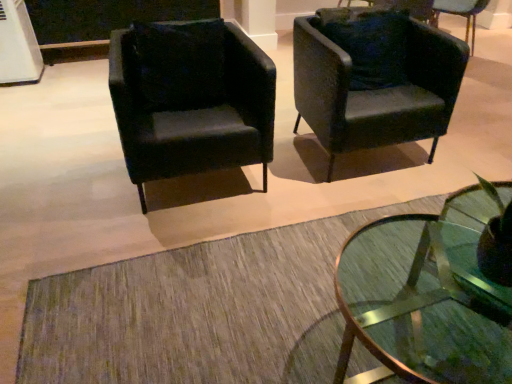
You are a GUI agent. You are given a task and a screenshot of the screen. Output one action in this format:
    pyautogui.click(x=<x>, y=<y>)
    Task: Click on the free point to the left of matte black armchair at left, which is the 1th chair in left-to-right order
    
    Given the screenshot: What is the action you would take?
    pyautogui.click(x=64, y=178)